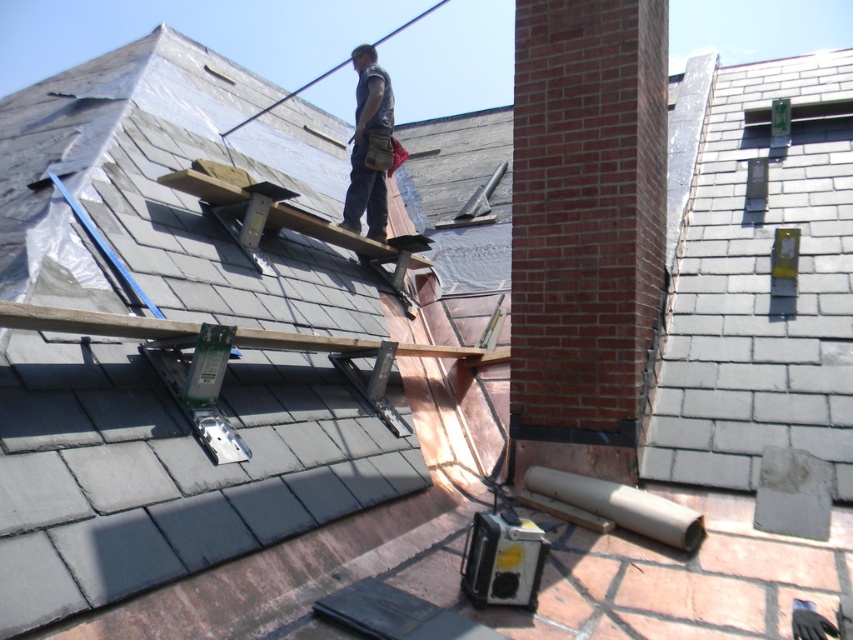
Does point (381, 342) come farther from viewer compared to point (387, 90)?

No.

Who is more forward, [321,346] or [363,45]?

Point [321,346] is in front.

The height and width of the screenshot is (640, 853). Find the location of `brown wooden beam at center`. brown wooden beam at center is located at coordinates (171, 330).